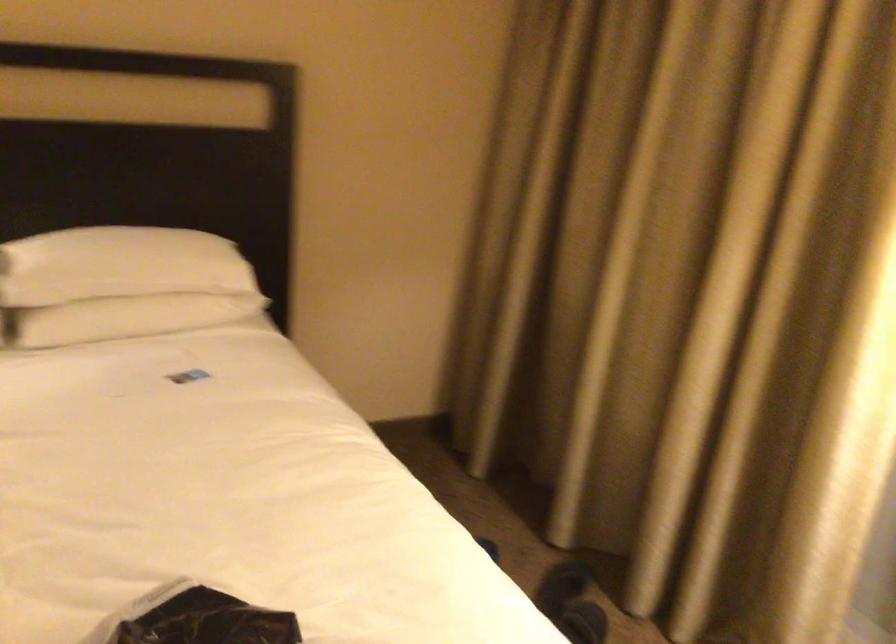
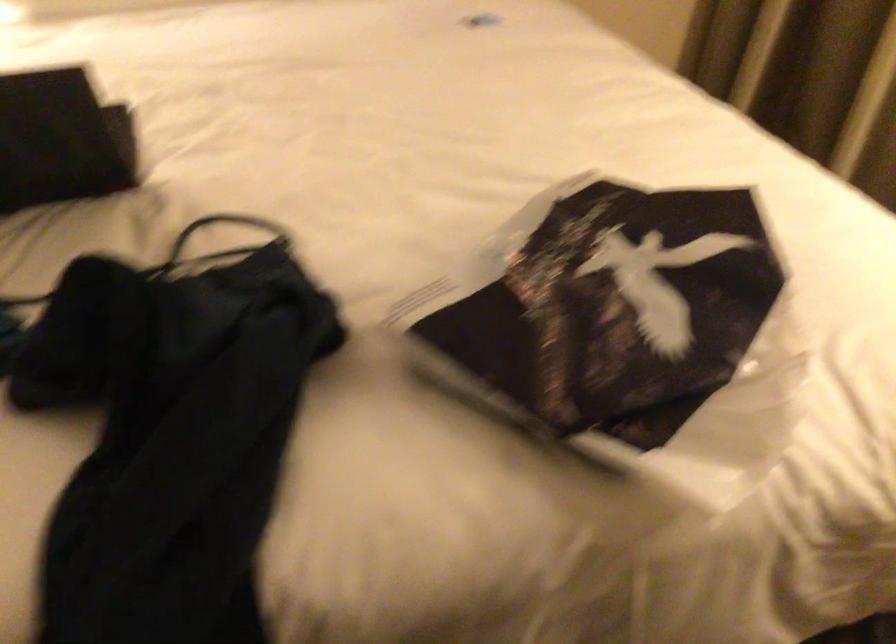
Question: Which direction would the cameraman need to move to produce the second image? Reply with the corresponding letter.

Choices:
 (A) Left
 (B) Right
 (C) Forward
 (D) Backward

Answer: (A)